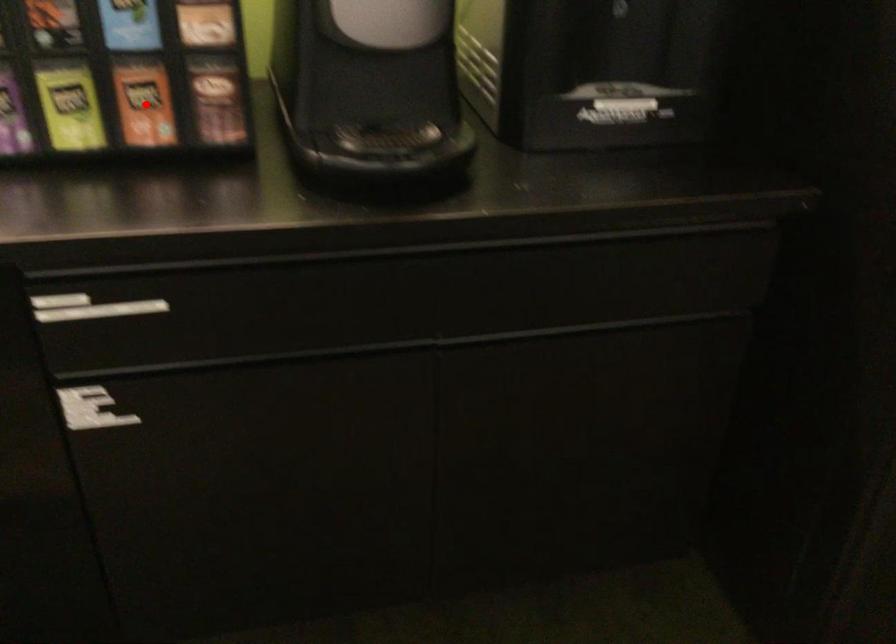
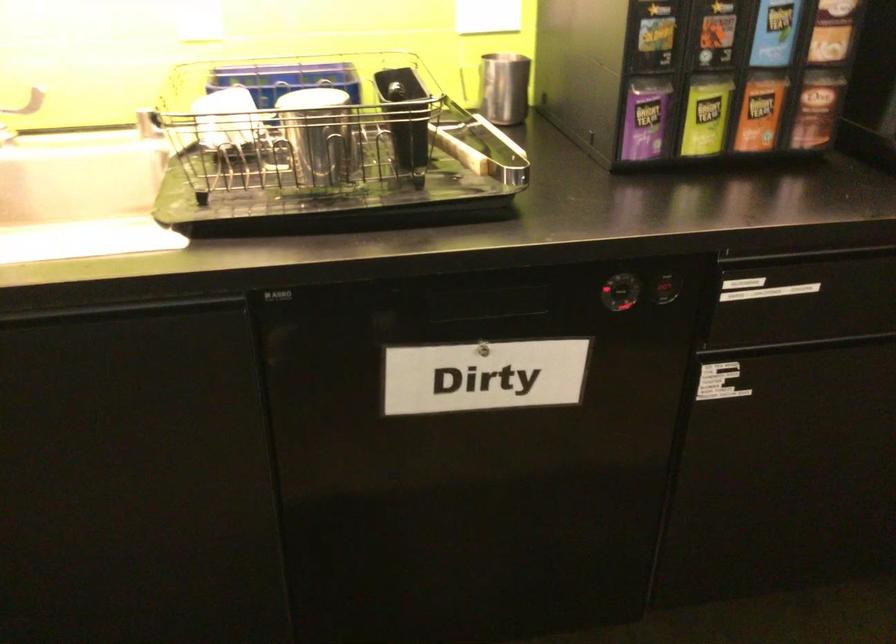
Question: I am providing you with two images of the same scene from different viewpoints. Given a red point in image1, look at the same physical point in image2. Is it:

Choices:
 (A) Closer to the viewpoint
 (B) Farther from the viewpoint

Answer: (B)